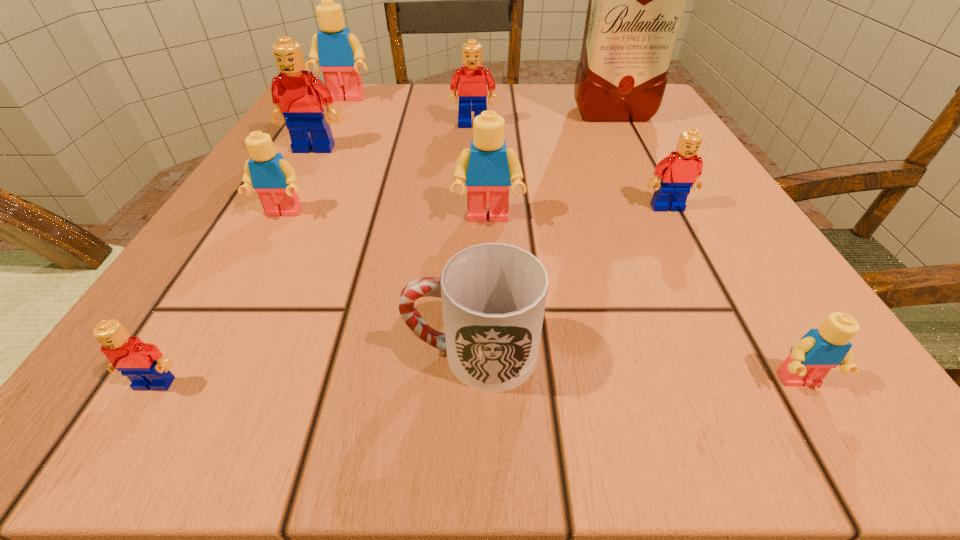
At what (x,y) coordinates should I click in order to perform the action: click on red Lego that can be found as the fourth closest to the liquor. Please return your answer as a coordinate pair (x, y). This screenshot has width=960, height=540. Looking at the image, I should click on (143, 363).

Where is `red Lego that is the third closest to the seventh nearest Lego`? The image size is (960, 540). red Lego that is the third closest to the seventh nearest Lego is located at coordinates (143, 363).

At what (x,y) coordinates should I click in order to perform the action: click on free space that satisfies the following two spatial constraints: 1. on the front-facing side of the third nearest red Lego; 2. on the side of the cup where the handle is located. Please return your answer as a coordinate pair (x, y). This screenshot has height=540, width=960. Looking at the image, I should click on (202, 353).

I want to click on free spot that satisfies the following two spatial constraints: 1. on the front-facing side of the farthest red Lego; 2. on the side of the cup where the handle is located, so click(468, 353).